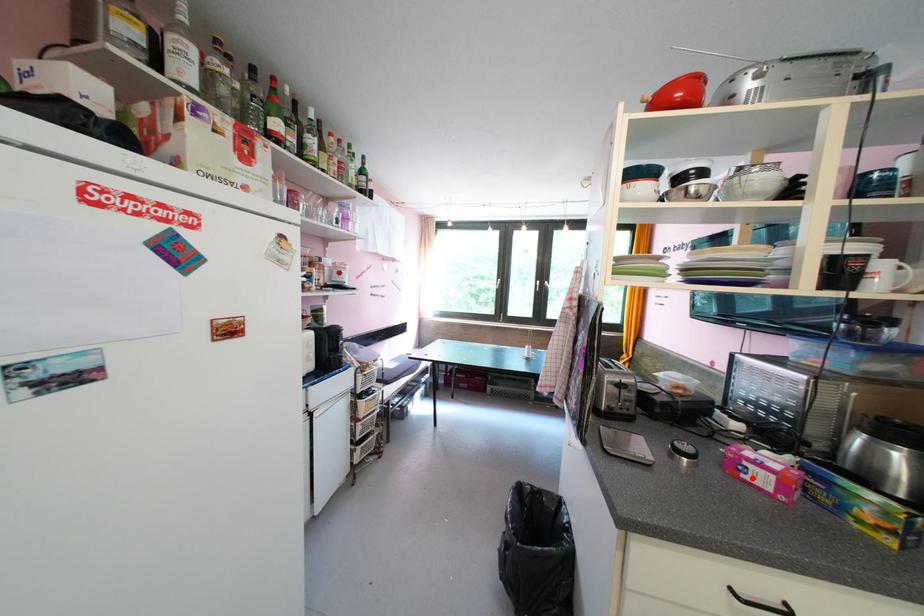
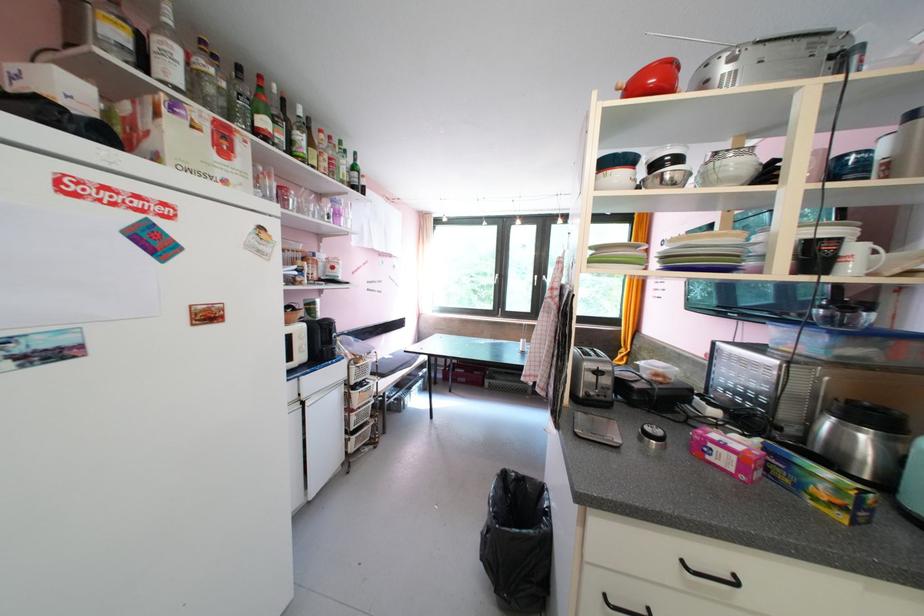
In the second image, find the point that corresponds to the highlighted location in the first image.

(716, 460)